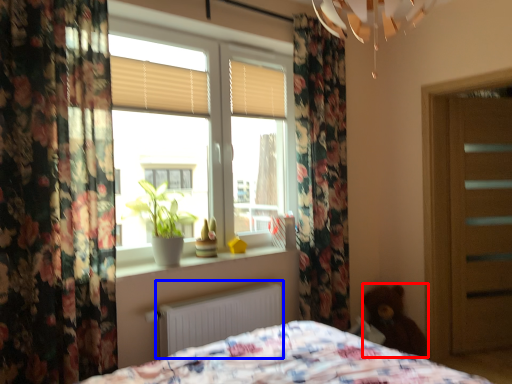
Question: Which object is closer to the camera taking this photo, teddy (highlighted by a red box) or radiator (highlighted by a blue box)?

Choices:
 (A) teddy
 (B) radiator

Answer: (B)